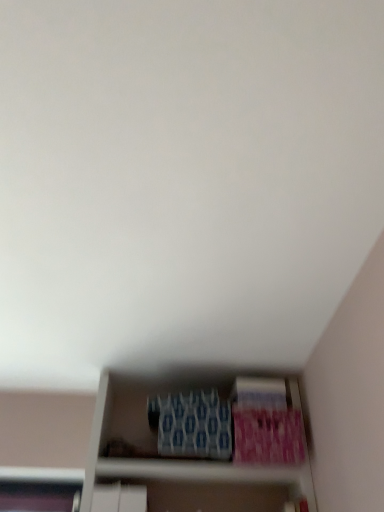
Question: Based on their sizes in the image, would you say pink matte paperback book at lower right, which is the 3th paperback book in left-to-right order, is bigger or smaller than blue textured paperback book at lower center, the second paperback book viewed from the left?

Choices:
 (A) big
 (B) small

Answer: (A)

Question: Is pink matte paperback book at lower right, which is the 3th paperback book in left-to-right order, inside the boundaries of blue textured paperback book at lower center, the second paperback book in the right-to-left sequence, or outside?

Choices:
 (A) inside
 (B) outside

Answer: (B)

Question: Which is nearer to the blue textured paperback book at center, the 3th paperback book in the right-to-left sequence?

Choices:
 (A) blue textured paperback book at lower center, the second paperback book in the right-to-left sequence
 (B) pink matte paperback book at lower right, which is the 3th paperback book in left-to-right order

Answer: (B)

Question: Estimate the real-world distances between objects in this image. Which object is closer to the pink matte paperback book at lower right, which is the 3th paperback book in left-to-right order?

Choices:
 (A) blue textured paperback book at center, the 1th paperback book in the left-to-right sequence
 (B) blue textured paperback book at lower center, the second paperback book in the right-to-left sequence

Answer: (B)